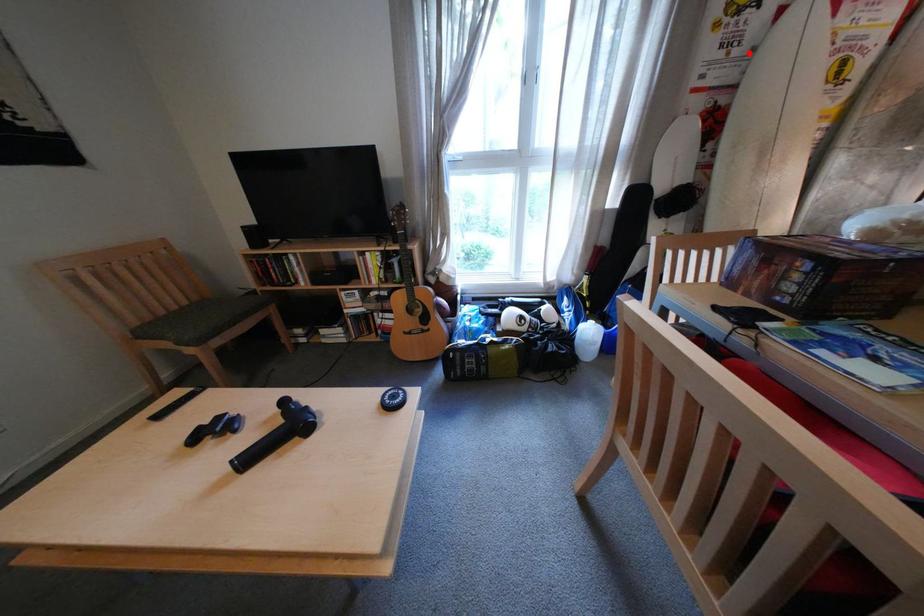
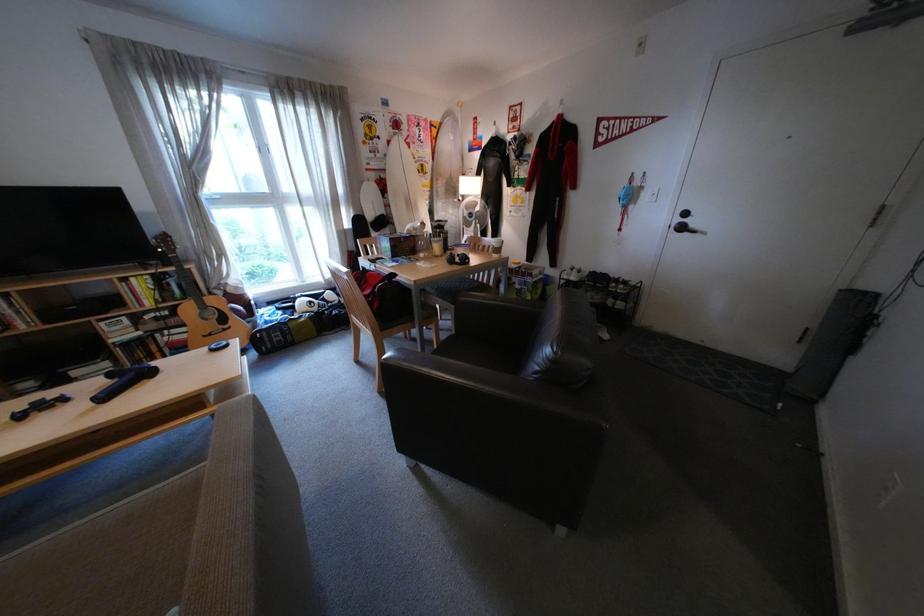
Question: I am providing you with two images of the same scene from different viewpoints. Image1 has a red point marked. In image2, the corresponding 3D location appears at what relative position? Reply with the corresponding letter.

Choices:
 (A) Closer
 (B) Farther

Answer: (A)